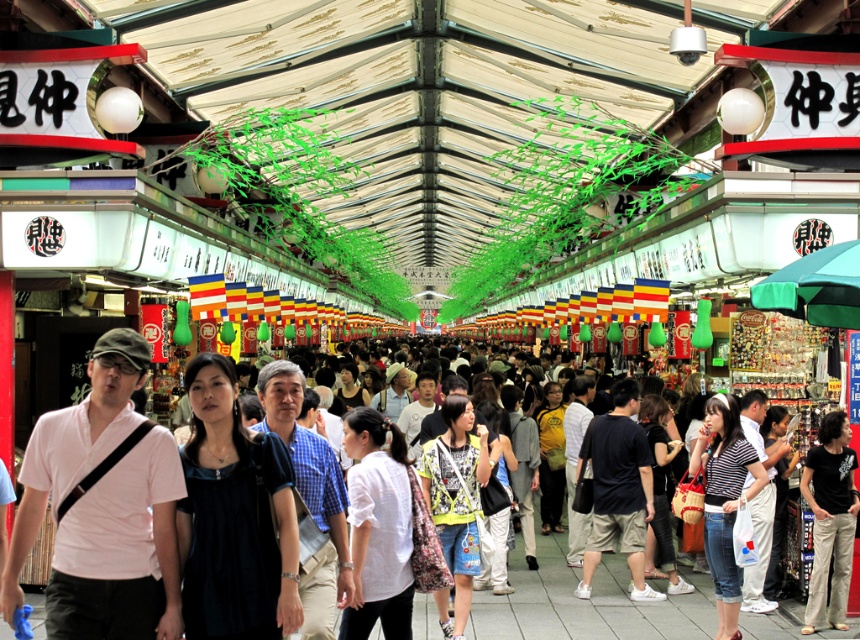
You are standing at the entrance of the market and want to reach a specific point marked as point (256, 545). The market has a rule that you must stay within 20 feet of the entrance at all times. Can you safely reach that point without violating the rule?

The distance between you and point (256, 545) is 23.35 feet, which exceeds the 20 feet limit. Therefore, you cannot safely reach that point without violating the market rule.

You are a vendor at the market and need to pack items into a storage box. You have a white matte shirt at center and a light gray fabric backpack at center. Which item should you choose if you want to place the smaller object into the box first?

The white matte shirt at center is smaller than the light gray fabric backpack at center, so you should choose the white matte shirt at center to place into the box first.

You are a photographer standing at the entrance of the market. You want to take a clear photo of the white matte shirt at center without any blur. Considering the camera you have has a minimum focus distance of 5 meters, will you be able to capture it clearly?

The white matte shirt at center is 8.21 meters away from camera, which is beyond the minimum focus distance of 5 meters, so yes, you can capture it clearly without blur.